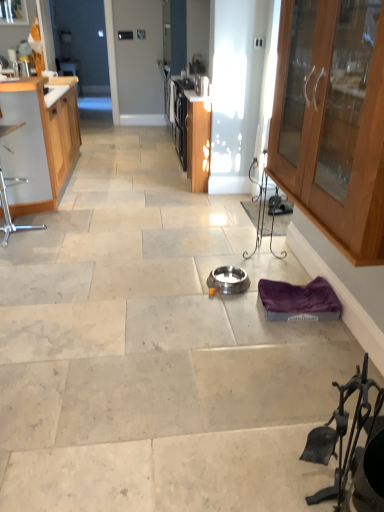
Question: In the image, is metallic silver chair at left, which is counted as the 1th chair, starting from the top, on the left side or the right side of wooden cabinet at left, acting as the first cabinetry starting from the back?

Choices:
 (A) right
 (B) left

Answer: (A)

Question: From a real-world perspective, is metallic silver chair at left, positioned as the 2th chair in right-to-left order, positioned above or below wooden cabinet at left, arranged as the first cabinetry when viewed from the left?

Choices:
 (A) below
 (B) above

Answer: (A)

Question: Which is nearer to the wooden cabinet at left, the 2th cabinetry positioned from the front?

Choices:
 (A) black wrought iron fireplace tools at lower right, which is the first chair from front to back
 (B) metallic stainless steel toaster at upper center, which appears as the first appliance when viewed from the back
 (C) wooden cabinet at right, marked as the second cabinetry in a back-to-front arrangement
 (D) metallic silver chair at left, the second chair from the front
 (E) satin silver bowl at center, the second appliance viewed from the left

Answer: (D)

Question: Estimate the real-world distances between objects in this image. Which object is closer to the black wrought iron fireplace tools at lower right, which is the 1th chair from bottom to top?

Choices:
 (A) metallic stainless steel toaster at upper center, positioned as the 1th appliance in left-to-right order
 (B) satin silver bowl at center, the second appliance viewed from the left
 (C) wooden cabinet at left, acting as the first cabinetry starting from the back
 (D) metallic silver chair at left, the second chair from the front
 (E) wooden cabinet at right, arranged as the 2th cabinetry when viewed from the left

Answer: (E)